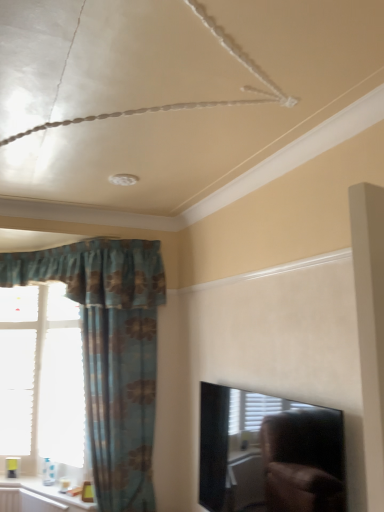
Question: Does black glossy tv at upper right lie behind blue floral fabric curtain at left?

Choices:
 (A) no
 (B) yes

Answer: (A)

Question: Is black glossy tv at upper right directly adjacent to blue floral fabric curtain at left?

Choices:
 (A) no
 (B) yes

Answer: (A)

Question: Is black glossy tv at upper right bigger than blue floral fabric curtain at left?

Choices:
 (A) yes
 (B) no

Answer: (B)

Question: Are black glossy tv at upper right and blue floral fabric curtain at left far apart?

Choices:
 (A) no
 (B) yes

Answer: (B)

Question: Considering the relative sizes of black glossy tv at upper right and blue floral fabric curtain at left in the image provided, is black glossy tv at upper right shorter than blue floral fabric curtain at left?

Choices:
 (A) no
 (B) yes

Answer: (B)

Question: From a real-world perspective, does black glossy tv at upper right stand above blue floral fabric curtain at left?

Choices:
 (A) yes
 (B) no

Answer: (B)

Question: Would you say white paper at left contains black glossy tv at upper right?

Choices:
 (A) no
 (B) yes

Answer: (A)

Question: Is there a large distance between white paper at left and black glossy tv at upper right?

Choices:
 (A) yes
 (B) no

Answer: (A)

Question: From the image's perspective, does white paper at left appear lower than black glossy tv at upper right?

Choices:
 (A) no
 (B) yes

Answer: (A)

Question: Is white paper at left positioned with its back to black glossy tv at upper right?

Choices:
 (A) no
 (B) yes

Answer: (A)

Question: Does white paper at left have a lesser height compared to black glossy tv at upper right?

Choices:
 (A) yes
 (B) no

Answer: (B)

Question: Does white paper at left have a lesser width compared to black glossy tv at upper right?

Choices:
 (A) yes
 (B) no

Answer: (B)

Question: From the image's perspective, would you say white glossy window sill at lower left is shown under blue floral fabric curtain at left?

Choices:
 (A) yes
 (B) no

Answer: (A)